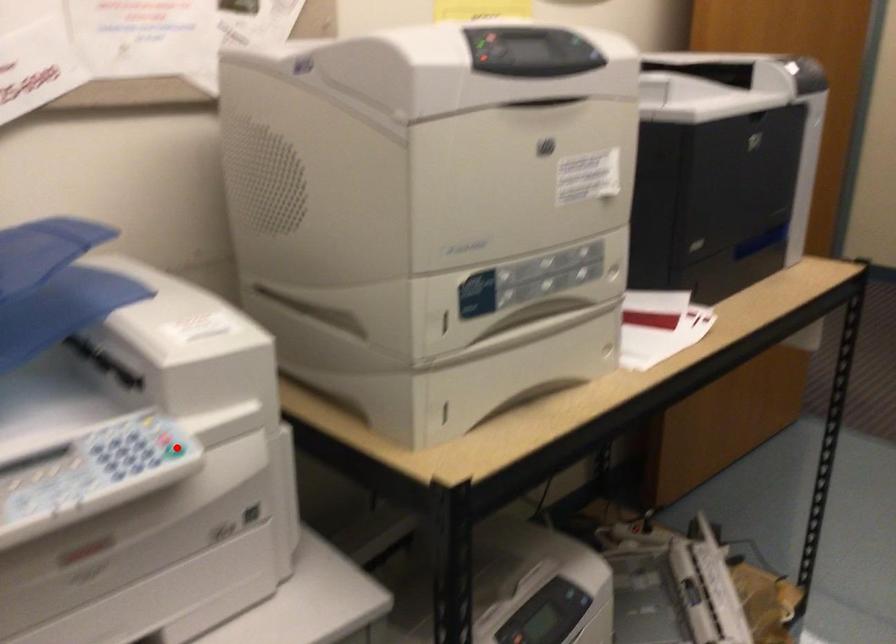
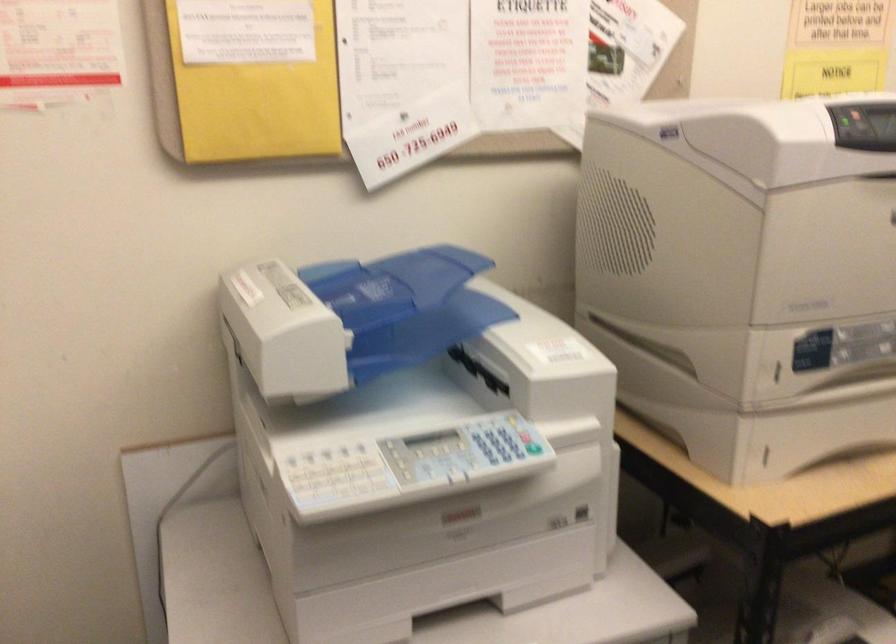
Where in the second image is the point corresponding to the highlighted location from the first image?

(533, 448)